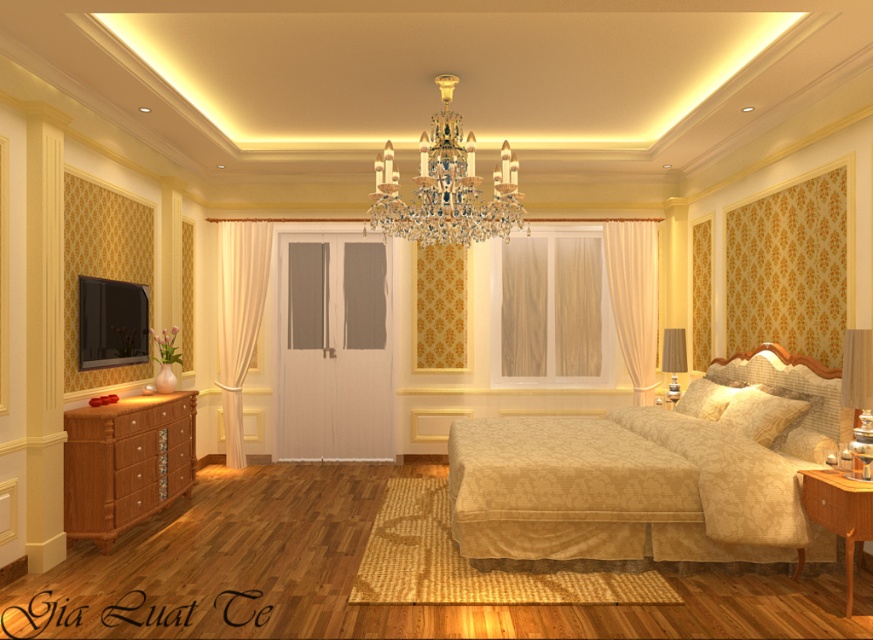
You are standing in the luxurious bedroom and want to place a new painting between the beige fabric bed at center and the matte glass lampshade at right. Based on their positions, which side of the painting should be closer to the bed?

The beige fabric bed at center is to the left of the matte glass lampshade at right, so the left side of the painting should be closer to the bed.

You are standing in the luxurious bedroom and want to take a photo of both point (101,445) and point (748,419). Since you want both points to be in focus, which point should you focus on first to ensure the other is also sharp?

You should focus on point (101,445) first because it is closer to the camera than point (748,419). By focusing on the closer point, the farther point will also be within the depth of field, ensuring both are sharp.

Consider the image. You are a guest in this bedroom and want to place a small vase on the light brown wooden nightstand at lower right. However, you notice the beige textured pillow at right is nearby. Considering their sizes, will the nightstand be able to support the vase without it being unstable?

The light brown wooden nightstand at lower right is much taller than the beige textured pillow at right, so it should provide a stable surface for the vase as it is higher and likely more sturdy.